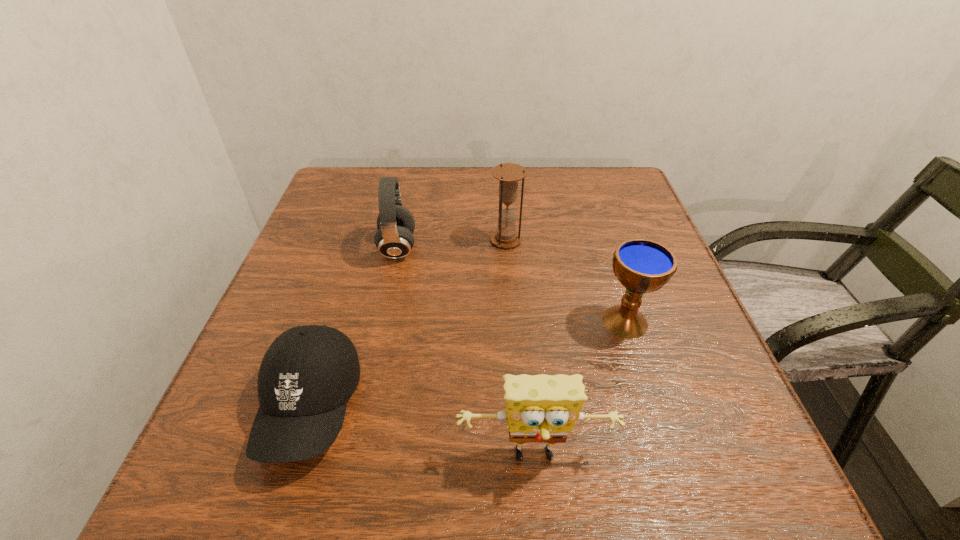
At what (x,y) coordinates should I click in order to perform the action: click on empty space between the baseball cap and the sponge. Please return your answer as a coordinate pair (x, y). This screenshot has width=960, height=540. Looking at the image, I should click on pyautogui.click(x=422, y=433).

The height and width of the screenshot is (540, 960). In order to click on free spot between the shortest object and the hourglass in this screenshot , I will do `click(408, 323)`.

You are a GUI agent. You are given a task and a screenshot of the screen. Output one action in this format:
    pyautogui.click(x=<x>, y=<y>)
    Task: Click on the vacant area that lies between the headset and the hourglass
    This screenshot has height=540, width=960.
    Given the screenshot: What is the action you would take?
    pyautogui.click(x=452, y=244)

Image resolution: width=960 pixels, height=540 pixels. What are the coordinates of `vacant area that lies between the shortest object and the sponge` in the screenshot? It's located at (422, 433).

The width and height of the screenshot is (960, 540). Identify the location of free spot between the baseball cap and the rightmost object. (468, 364).

At what (x,y) coordinates should I click in order to perform the action: click on vacant space in between the hourglass and the chalice. Please return your answer as a coordinate pair (x, y). The image size is (960, 540). Looking at the image, I should click on (565, 281).

Find the location of `vacant point located between the rightmost object and the shortest object`. vacant point located between the rightmost object and the shortest object is located at coordinates (468, 364).

Identify the location of free space that is in between the headset and the chalice. Image resolution: width=960 pixels, height=540 pixels. (512, 285).

The width and height of the screenshot is (960, 540). I want to click on free space between the hourglass and the headset, so click(x=452, y=244).

This screenshot has height=540, width=960. Identify the location of blank region between the sponge and the hourglass. (520, 349).